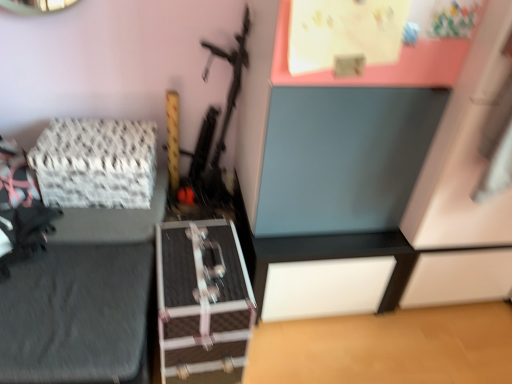
Where is `vacant space in front of matte blue drawer at upper center`? The width and height of the screenshot is (512, 384). vacant space in front of matte blue drawer at upper center is located at coordinates (328, 352).